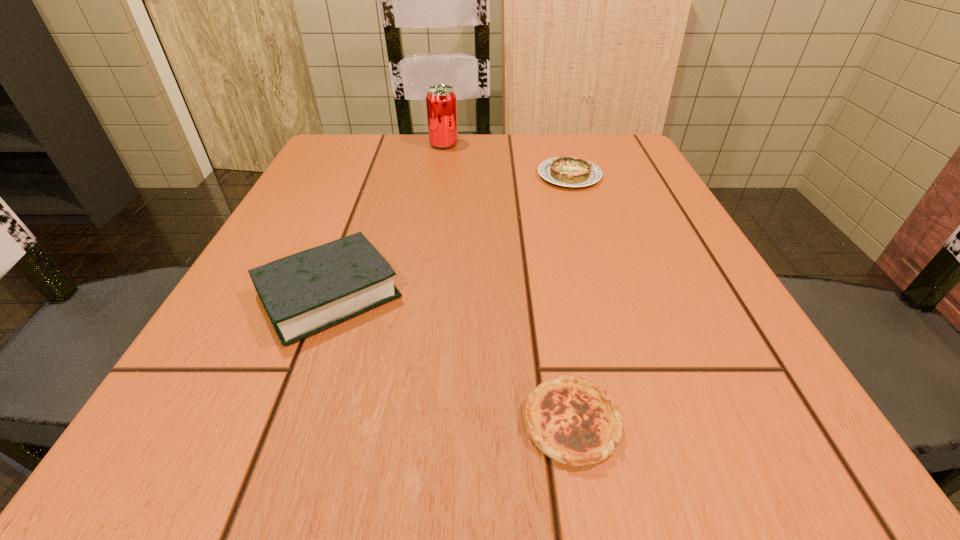
The height and width of the screenshot is (540, 960). Find the location of `the tallest object`. the tallest object is located at coordinates (441, 101).

What are the coordinates of `soda can` in the screenshot? It's located at (441, 101).

Image resolution: width=960 pixels, height=540 pixels. In order to click on the second tallest object in this screenshot , I will do pyautogui.click(x=304, y=293).

Locate an element on the screen. This screenshot has width=960, height=540. the third farthest object is located at coordinates (304, 293).

Locate an element on the screen. This screenshot has width=960, height=540. the farther quiche is located at coordinates tap(567, 171).

Locate an element on the screen. the nearer quiche is located at coordinates (574, 421).

Image resolution: width=960 pixels, height=540 pixels. I want to click on free region located 0.280m on the right of the farthest object, so click(576, 145).

Where is `vacant space situated 0.160m on the front of the third shortest object`? This screenshot has width=960, height=540. vacant space situated 0.160m on the front of the third shortest object is located at coordinates (264, 468).

I want to click on blank space located 0.320m on the front of the third nearest object, so click(x=610, y=303).

Image resolution: width=960 pixels, height=540 pixels. I want to click on vacant region located on the right of the nearest object, so click(663, 423).